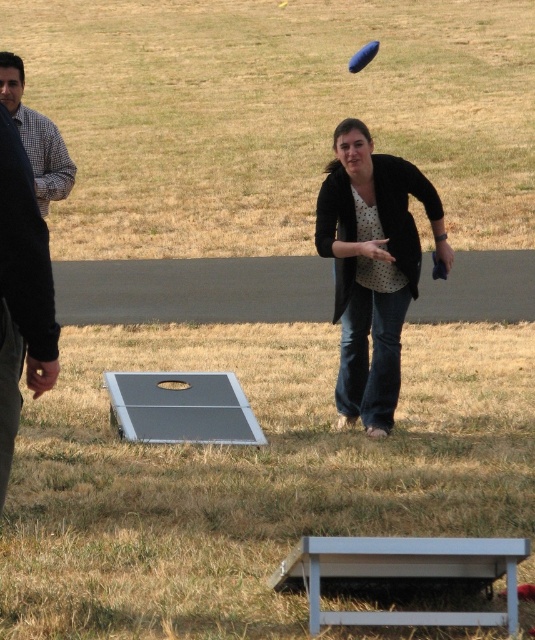
Question: Does polka dot blouse at center appear over checkered fabric shirt at left?

Choices:
 (A) yes
 (B) no

Answer: (B)

Question: Does metallic gray board at center appear on the right side of smooth gray board at center?

Choices:
 (A) yes
 (B) no

Answer: (B)

Question: Which point appears closest to the camera in this image?

Choices:
 (A) (370, 326)
 (B) (56, 516)
 (C) (374, 51)

Answer: (B)

Question: Is metallic gray board at center to the right of checkered fabric shirt at left from the viewer's perspective?

Choices:
 (A) no
 (B) yes

Answer: (B)

Question: Which of the following is the closest to the observer?

Choices:
 (A) checkered fabric shirt at left
 (B) polka dot blouse at center
 (C) smooth gray board at center

Answer: (B)

Question: Which of these objects is positioned farthest from the smooth gray board at center?

Choices:
 (A) polka dot blouse at center
 (B) checkered fabric shirt at left
 (C) blue rubber frisbee at upper center
 (D) metallic gray board at center

Answer: (B)